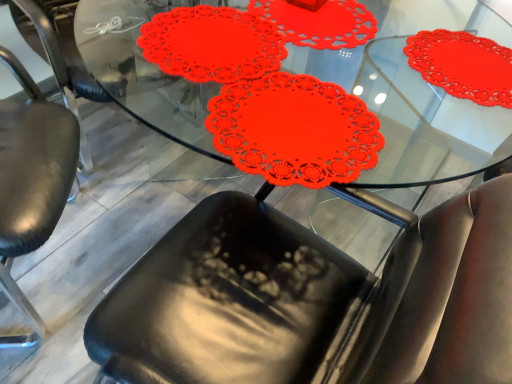
In order to click on black leather chair at lower left in this screenshot , I will do pos(33,165).

What do you see at coordinates (33, 165) in the screenshot? I see `black leather chair at lower left` at bounding box center [33, 165].

Image resolution: width=512 pixels, height=384 pixels. What do you see at coordinates (416, 98) in the screenshot? I see `red paper doily at center` at bounding box center [416, 98].

The height and width of the screenshot is (384, 512). Find the location of `red paper doily at center`. red paper doily at center is located at coordinates (416, 98).

Find the location of a particular element. This screenshot has height=384, width=512. black leather chair at lower left is located at coordinates (33, 165).

Looking at this image, is black leather chair at lower left to the left of red paper doily at center from the viewer's perspective?

Yes.

Which object is closer to the camera, black leather chair at lower left or red paper doily at center?

Positioned in front is red paper doily at center.

Which is in front, point (4, 179) or point (372, 59)?

The point (4, 179) is closer to the camera.

From the image's perspective, is black leather chair at lower left below red paper doily at center?

No, from the image's perspective, black leather chair at lower left is not beneath red paper doily at center.

From the picture: From a real-world perspective, is black leather chair at lower left positioned under red paper doily at center based on gravity?

Yes, from a real-world perspective, black leather chair at lower left is beneath red paper doily at center.

Considering the relative sizes of black leather chair at lower left and red paper doily at center in the image provided, is black leather chair at lower left thinner than red paper doily at center?

Yes, black leather chair at lower left is thinner than red paper doily at center.

Does black leather chair at lower left have a lesser height compared to red paper doily at center?

In fact, black leather chair at lower left may be taller than red paper doily at center.

Which of these two, black leather chair at lower left or red paper doily at center, is smaller?

Smaller between the two is black leather chair at lower left.

Choose the correct answer: Is black leather chair at lower left inside red paper doily at center or outside it?

black leather chair at lower left lies outside red paper doily at center.

Is black leather chair at lower left not close to red paper doily at center?

Indeed, black leather chair at lower left is not near red paper doily at center.

Is black leather chair at lower left positioned with its back to red paper doily at center?

black leather chair at lower left does not have its back to red paper doily at center.

Find the location of a particular element. This screenshot has width=512, height=384. table that appears in front of the black leather chair at lower left is located at coordinates (416, 98).

Considering the relative positions of red paper doily at center and black leather chair at lower left in the image provided, is red paper doily at center to the left or to the right of black leather chair at lower left?

red paper doily at center is to the right of black leather chair at lower left.

Which object is closer to the camera taking this photo, red paper doily at center or black leather chair at lower left?

red paper doily at center is in front.

Is point (362, 80) closer or farther from the camera than point (55, 179)?

Clearly, point (362, 80) is more distant from the camera than point (55, 179).

From the image's perspective, which is above, red paper doily at center or black leather chair at lower left?

black leather chair at lower left.

From a real-world perspective, between red paper doily at center and black leather chair at lower left, who is vertically lower?

black leather chair at lower left is physically lower.

Does red paper doily at center have a lesser width compared to black leather chair at lower left?

No, red paper doily at center is not thinner than black leather chair at lower left.

Which of these two, red paper doily at center or black leather chair at lower left, stands shorter?

red paper doily at center.

Can you confirm if red paper doily at center is smaller than black leather chair at lower left?

Actually, red paper doily at center might be larger than black leather chair at lower left.

Could black leather chair at lower left be considered to be inside red paper doily at center?

No, black leather chair at lower left is not inside red paper doily at center.

Is red paper doily at center not near black leather chair at lower left?

Indeed, red paper doily at center is not near black leather chair at lower left.

Is red paper doily at center oriented towards black leather chair at lower left?

Yes, red paper doily at center faces towards black leather chair at lower left.

Find the location of a particular element. chair below the red paper doily at center (from a real-world perspective) is located at coordinates (33, 165).

Where is `table that appears in front of the black leather chair at lower left`? The image size is (512, 384). table that appears in front of the black leather chair at lower left is located at coordinates (416, 98).

At what (x,y) coordinates should I click in order to perform the action: click on table on the right of black leather chair at lower left. Please return your answer as a coordinate pair (x, y). Looking at the image, I should click on (416, 98).